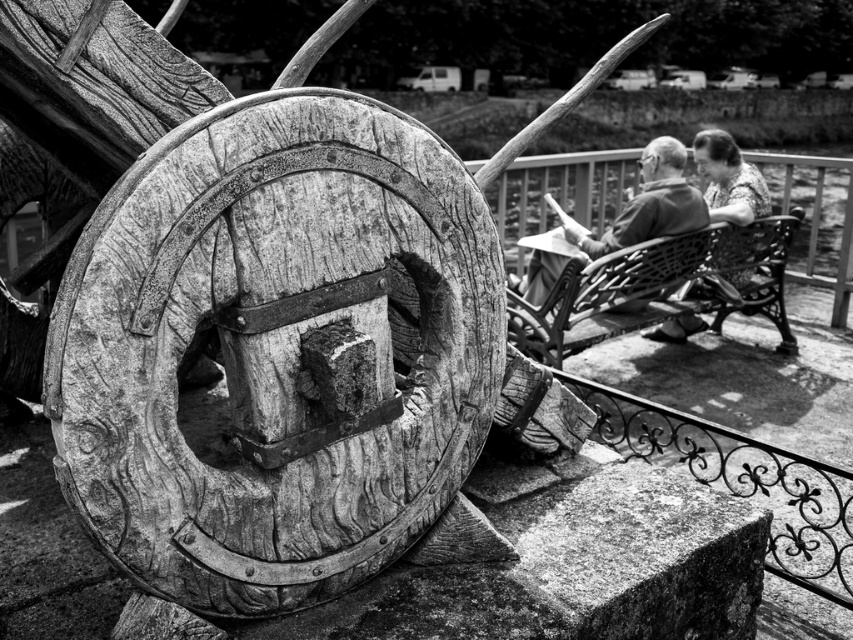
Question: Among these objects, which one is nearest to the camera?

Choices:
 (A) smooth fabric blouse at upper right
 (B) smooth wood chair at upper right
 (C) woven wicker bench at right

Answer: (C)

Question: In this image, where is smooth wood chair at upper right located relative to smooth fabric blouse at upper right?

Choices:
 (A) left
 (B) right

Answer: (A)

Question: Which point appears closest to the camera in this image?

Choices:
 (A) (686, 305)
 (B) (717, 184)
 (C) (577, 221)

Answer: (A)

Question: Can you confirm if smooth wood chair at upper right is thinner than smooth fabric blouse at upper right?

Choices:
 (A) no
 (B) yes

Answer: (A)

Question: Which point appears closest to the camera in this image?

Choices:
 (A) (677, 209)
 (B) (602, 332)

Answer: (B)

Question: In this image, where is smooth wood chair at upper right located relative to smooth fabric blouse at upper right?

Choices:
 (A) right
 (B) left

Answer: (B)